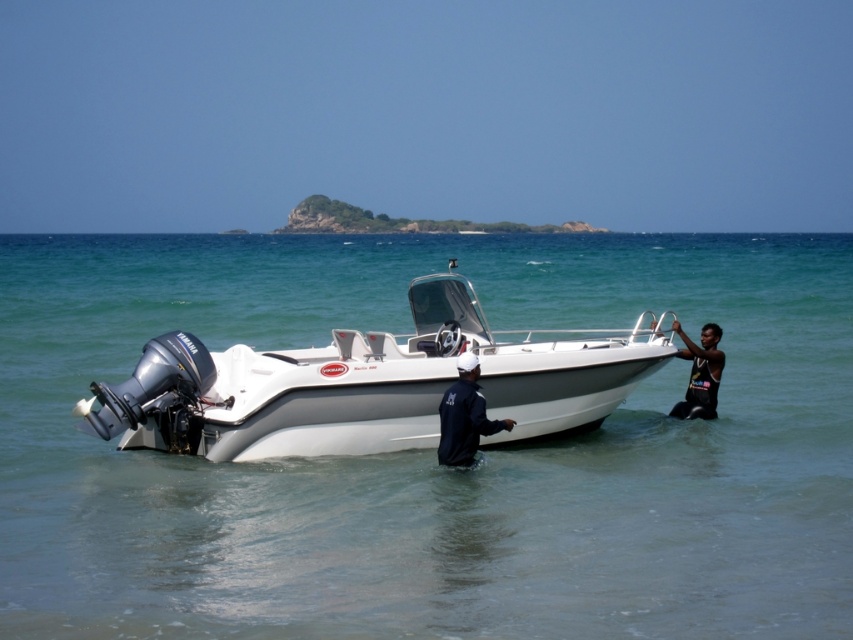
Between white glossy water at center and black matte wetsuit at right, which one has less height?

Standing shorter between the two is black matte wetsuit at right.

In the scene shown: Can you confirm if white glossy water at center is taller than black matte wetsuit at right?

Correct, white glossy water at center is much taller as black matte wetsuit at right.

Describe the element at coordinates (433, 449) in the screenshot. I see `white glossy water at center` at that location.

At what (x,y) coordinates should I click in order to perform the action: click on white glossy water at center. Please return your answer as a coordinate pair (x, y). The image size is (853, 640). Looking at the image, I should click on (433, 449).

Between white glossy water at center and white glossy boat at center, which one appears on the left side from the viewer's perspective?

Positioned to the left is white glossy boat at center.

The image size is (853, 640). What do you see at coordinates (433, 449) in the screenshot? I see `white glossy water at center` at bounding box center [433, 449].

Who is more distant from viewer, (775, 433) or (254, 381)?

The point (775, 433) is behind.

At what (x,y) coordinates should I click in order to perform the action: click on white glossy water at center. Please return your answer as a coordinate pair (x, y). This screenshot has width=853, height=640. Looking at the image, I should click on (433, 449).

Is point (460, 355) more distant than point (711, 392)?

That is False.

Based on the photo, is dark blue fabric jacket at center further to camera compared to black matte wetsuit at right?

No, dark blue fabric jacket at center is closer to the viewer.

Where is `dark blue fabric jacket at center`? dark blue fabric jacket at center is located at coordinates (463, 416).

Where is `dark blue fabric jacket at center`? This screenshot has height=640, width=853. dark blue fabric jacket at center is located at coordinates (463, 416).